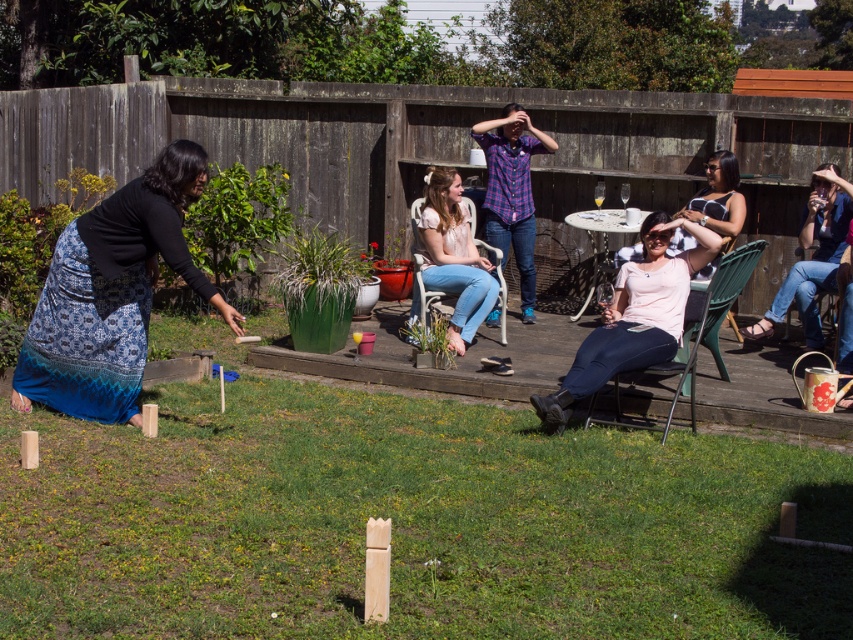
You are planning to set up a picnic blanket in the backyard where the game of kubb is being played. The picnic blanket is the size of the blue jeans at right. Will the natural grass at center be enough space to place the blanket?

The natural grass at center is bigger than blue jeans at right, so yes, the natural grass at center has enough space to place the picnic blanket since it is larger than the blue jeans at right.

You are a photographer trying to capture the natural grass at center and blue jeans at right in a single shot. Based on their positions, which object should you focus on first to ensure both are in frame?

The natural grass at center is below blue jeans at right, so you should focus on the blue jeans at right first to ensure both are in frame.